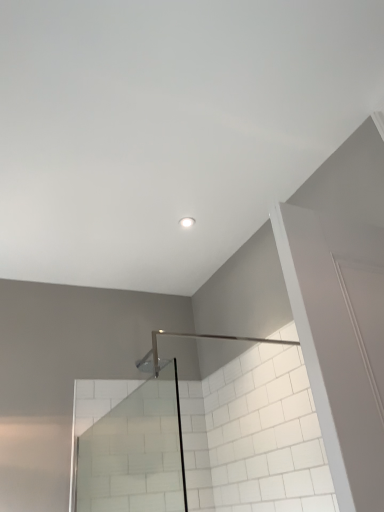
Question: Considering the positions of white glossy light fixture at center and transparent glass shower door at center in the image, is white glossy light fixture at center bigger or smaller than transparent glass shower door at center?

Choices:
 (A) big
 (B) small

Answer: (B)

Question: Does point (188, 219) appear closer or farther from the camera than point (165, 433)?

Choices:
 (A) closer
 (B) farther

Answer: (A)

Question: Considering the positions of white glossy light fixture at center and transparent glass shower door at center in the image, is white glossy light fixture at center wider or thinner than transparent glass shower door at center?

Choices:
 (A) wide
 (B) thin

Answer: (B)

Question: Is transparent glass shower door at center taller or shorter than white glossy light fixture at center?

Choices:
 (A) short
 (B) tall

Answer: (B)

Question: Considering the positions of transparent glass shower door at center and white glossy light fixture at center in the image, is transparent glass shower door at center wider or thinner than white glossy light fixture at center?

Choices:
 (A) wide
 (B) thin

Answer: (A)

Question: Considering the positions of transparent glass shower door at center and white glossy light fixture at center in the image, is transparent glass shower door at center bigger or smaller than white glossy light fixture at center?

Choices:
 (A) big
 (B) small

Answer: (A)

Question: In the image, is transparent glass shower door at center on the left side or the right side of white glossy light fixture at center?

Choices:
 (A) left
 (B) right

Answer: (A)